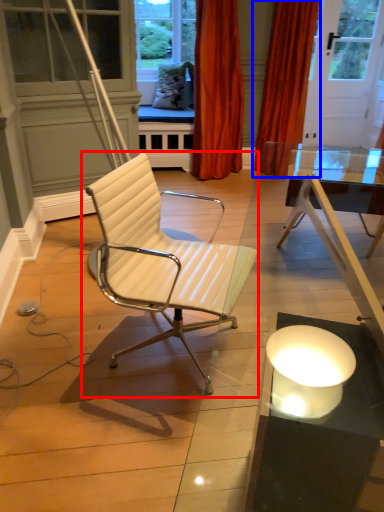
Question: Which point is further to the camera, chair (highlighted by a red box) or curtain (highlighted by a blue box)?

Choices:
 (A) chair
 (B) curtain

Answer: (B)